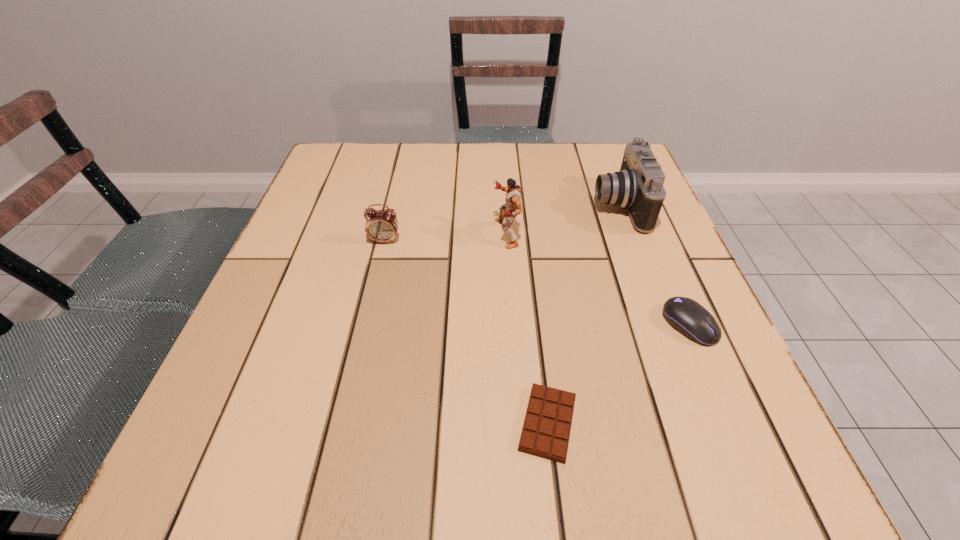
Where is `free space located 0.220m on the front-facing side of the puncher`? Image resolution: width=960 pixels, height=540 pixels. free space located 0.220m on the front-facing side of the puncher is located at coordinates (393, 233).

This screenshot has width=960, height=540. I want to click on vacant space located 0.390m on the front-facing side of the camera, so click(427, 206).

You are a GUI agent. You are given a task and a screenshot of the screen. Output one action in this format:
    pyautogui.click(x=<x>, y=<y>)
    Task: Click on the vacant space located 0.280m on the front-facing side of the camera
    The height and width of the screenshot is (540, 960).
    Given the screenshot: What is the action you would take?
    pyautogui.click(x=474, y=206)

Where is `free spot located 0.050m on the front-facing side of the camera`? This screenshot has width=960, height=540. free spot located 0.050m on the front-facing side of the camera is located at coordinates (572, 206).

The width and height of the screenshot is (960, 540). I want to click on free spot located 0.280m on the face of the leftmost object, so click(358, 354).

This screenshot has height=540, width=960. What are the coordinates of `free location located on the left of the computer mouse` in the screenshot? It's located at (580, 325).

Identify the location of vacant area located 0.150m on the right of the nearest object. The image size is (960, 540). (681, 423).

At what (x,y) coordinates should I click in order to perform the action: click on object situated at the far edge. Please return your answer as a coordinate pair (x, y). Image resolution: width=960 pixels, height=540 pixels. Looking at the image, I should click on (638, 187).

The width and height of the screenshot is (960, 540). I want to click on object situated at the near edge, so click(x=546, y=430).

Find the location of a particular element. This screenshot has width=960, height=540. camera that is at the right edge is located at coordinates (638, 187).